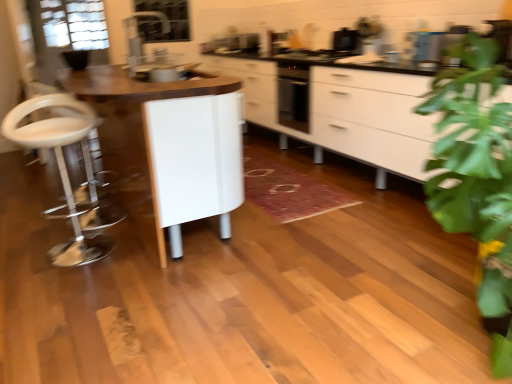
Question: From a real-world perspective, is white glossy cabinet at center physically above transparent glass door at upper left?

Choices:
 (A) yes
 (B) no

Answer: (B)

Question: From the image's perspective, would you say white glossy cabinet at center is positioned over transparent glass door at upper left?

Choices:
 (A) no
 (B) yes

Answer: (A)

Question: Considering the relative sizes of white glossy cabinet at center and transparent glass door at upper left in the image provided, is white glossy cabinet at center shorter than transparent glass door at upper left?

Choices:
 (A) yes
 (B) no

Answer: (B)

Question: Is white glossy cabinet at center far from transparent glass door at upper left?

Choices:
 (A) yes
 (B) no

Answer: (A)

Question: Is white glossy cabinet at center facing towards transparent glass door at upper left?

Choices:
 (A) yes
 (B) no

Answer: (B)

Question: Is white glossy table at center situated inside clear glass window screen at upper center or outside?

Choices:
 (A) outside
 (B) inside

Answer: (A)

Question: From a real-world perspective, is white glossy table at center positioned above or below clear glass window screen at upper center?

Choices:
 (A) above
 (B) below

Answer: (B)

Question: Considering the positions of white glossy table at center and clear glass window screen at upper center in the image, is white glossy table at center wider or thinner than clear glass window screen at upper center?

Choices:
 (A) wide
 (B) thin

Answer: (A)

Question: Looking at the image, does white glossy table at center seem bigger or smaller compared to clear glass window screen at upper center?

Choices:
 (A) big
 (B) small

Answer: (A)

Question: From a real-world perspective, is white glossy cabinet at center physically located above or below transparent glass door at upper left?

Choices:
 (A) below
 (B) above

Answer: (A)

Question: Is point (264, 61) closer or farther from the camera than point (30, 11)?

Choices:
 (A) closer
 (B) farther

Answer: (B)

Question: Is white glossy cabinet at center wider or thinner than transparent glass door at upper left?

Choices:
 (A) wide
 (B) thin

Answer: (A)

Question: From the image's perspective, is white glossy cabinet at center above or below transparent glass door at upper left?

Choices:
 (A) below
 (B) above

Answer: (A)

Question: Considering their positions, is clear glass window screen at upper center located in front of or behind white glossy table at center?

Choices:
 (A) front
 (B) behind

Answer: (B)

Question: Visually, is clear glass window screen at upper center positioned to the left or to the right of white glossy table at center?

Choices:
 (A) left
 (B) right

Answer: (A)